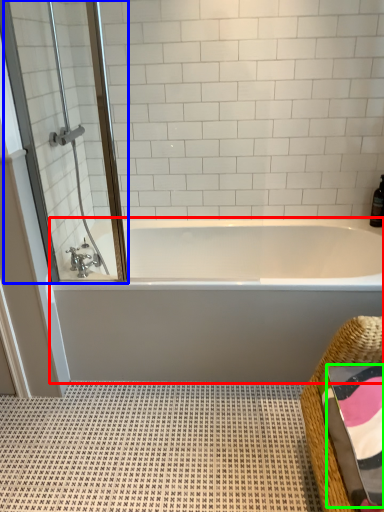
Question: Which object is positioned farthest from bathtub (highlighted by a red box)? Select from screen door (highlighted by a blue box) and bath towel (highlighted by a green box).

Choices:
 (A) screen door
 (B) bath towel

Answer: (B)